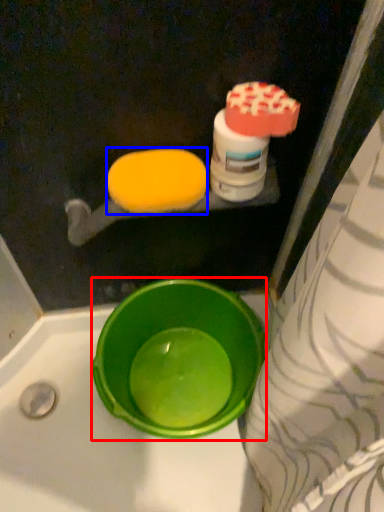
Question: Which object is further to the camera taking this photo, basin (highlighted by a red box) or food (highlighted by a blue box)?

Choices:
 (A) basin
 (B) food

Answer: (A)